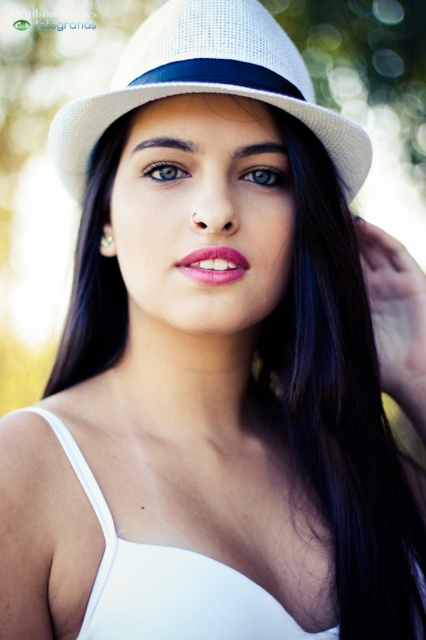
Is white woven fedora at upper center shorter than blue glossy eye at upper center?

Incorrect, white woven fedora at upper center's height does not fall short of blue glossy eye at upper center's.

Between point (331, 134) and point (175, 164), which one is positioned in front?

Point (175, 164)

This screenshot has height=640, width=426. In order to click on white woven fedora at upper center in this screenshot , I will do `click(207, 83)`.

Is pink glossy lips at center thinner than blue glossy eye at upper center?

No, pink glossy lips at center is not thinner than blue glossy eye at upper center.

Does pink glossy lips at center lie behind blue glossy eye at upper center?

No, it is not.

Is point (244, 273) positioned after point (187, 176)?

No, it is not.

What are the coordinates of `pink glossy lips at center` in the screenshot? It's located at (213, 264).

Is point (241, 577) more distant than point (270, 182)?

No, (241, 577) is closer to viewer.

Who is positioned more to the right, white fabric dress at center or green matte eye at center?

green matte eye at center is more to the right.

Between point (158, 573) and point (256, 180), which one is positioned behind?

Point (256, 180)

Identify the location of white fabric dress at center. The height and width of the screenshot is (640, 426). (167, 582).